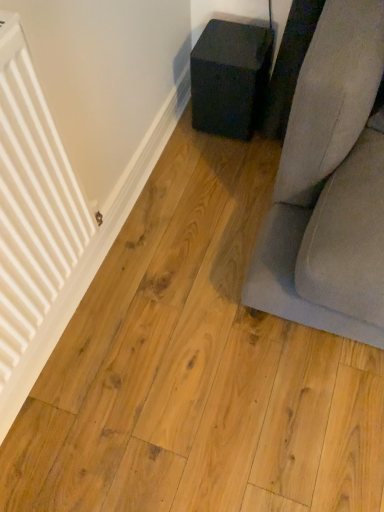
What do you see at coordinates (32, 225) in the screenshot?
I see `white matte radiator at left` at bounding box center [32, 225].

In order to click on white matte radiator at left in this screenshot , I will do `click(32, 225)`.

Measure the distance between matte black cube at center and camera.

The distance of matte black cube at center from camera is 4.59 feet.

This screenshot has height=512, width=384. I want to click on matte black cube at center, so click(230, 77).

What do you see at coordinates (230, 77) in the screenshot? I see `matte black cube at center` at bounding box center [230, 77].

Identify the location of white matte radiator at left. Image resolution: width=384 pixels, height=512 pixels. (32, 225).

Considering the positions of objects matte black cube at center and white matte radiator at left in the image provided, who is more to the left, matte black cube at center or white matte radiator at left?

From the viewer's perspective, white matte radiator at left appears more on the left side.

Which object is further away from the camera, matte black cube at center or white matte radiator at left?

Positioned behind is matte black cube at center.

Is point (211, 32) more distant than point (30, 339)?

Yes, it is.

From the image's perspective, is matte black cube at center above white matte radiator at left?

Yes, from the image's perspective, matte black cube at center is over white matte radiator at left.

Consider the image. From a real-world perspective, which is physically above, matte black cube at center or white matte radiator at left?

white matte radiator at left is physically above.

Between matte black cube at center and white matte radiator at left, which one has smaller width?

With smaller width is white matte radiator at left.

From their relative heights in the image, would you say matte black cube at center is taller or shorter than white matte radiator at left?

In the image, matte black cube at center appears to be shorter than white matte radiator at left.

Based on their sizes in the image, would you say matte black cube at center is bigger or smaller than white matte radiator at left?

Clearly, matte black cube at center is smaller in size than white matte radiator at left.

Is white matte radiator at left surrounded by matte black cube at center?

→ No.

Does matte black cube at center touch white matte radiator at left?

matte black cube at center is not next to white matte radiator at left, and they're not touching.

Is matte black cube at center facing towards white matte radiator at left?

Yes, matte black cube at center is aimed at white matte radiator at left.

How many degrees apart are the facing directions of matte black cube at center and white matte radiator at left?

85.2 degrees separate the facing orientations of matte black cube at center and white matte radiator at left.

Image resolution: width=384 pixels, height=512 pixels. I want to click on furniture below the white matte radiator at left (from a real-world perspective), so click(230, 77).

In the scene shown: Considering the positions of objects white matte radiator at left and matte black cube at center in the image provided, who is more to the left, white matte radiator at left or matte black cube at center?

From the viewer's perspective, white matte radiator at left appears more on the left side.

In the image, is white matte radiator at left positioned in front of or behind matte black cube at center?

Clearly, white matte radiator at left is in front of matte black cube at center.

Is point (28, 176) closer or farther from the camera than point (217, 102)?

Point (28, 176) is positioned closer to the camera compared to point (217, 102).

From the image's perspective, which one is positioned lower, white matte radiator at left or matte black cube at center?

From the image's view, white matte radiator at left is below.

From a real-world perspective, relative to matte black cube at center, is white matte radiator at left vertically above or below?

Clearly, from a real-world perspective, white matte radiator at left is above matte black cube at center.

Can you confirm if white matte radiator at left is wider than matte black cube at center?

No, white matte radiator at left is not wider than matte black cube at center.

Does white matte radiator at left have a greater height compared to matte black cube at center?

Correct, white matte radiator at left is much taller as matte black cube at center.

In the scene shown: Is white matte radiator at left bigger or smaller than matte black cube at center?

Clearly, white matte radiator at left is larger in size than matte black cube at center.

Which is correct: white matte radiator at left is inside matte black cube at center, or outside of it?

white matte radiator at left is not enclosed by matte black cube at center.

Is white matte radiator at left in contact with matte black cube at center?

No, white matte radiator at left is not in contact with matte black cube at center.

Is matte black cube at center at the back of white matte radiator at left?

white matte radiator at left does not have its back to matte black cube at center.

How different are the orientations of white matte radiator at left and matte black cube at center in degrees?

The angular difference between white matte radiator at left and matte black cube at center is 85.2 degrees.

How much distance is there between white matte radiator at left and matte black cube at center?

white matte radiator at left is 32.86 inches from matte black cube at center.

This screenshot has width=384, height=512. Identify the location of furniture below the white matte radiator at left (from a real-world perspective). (230, 77).

Image resolution: width=384 pixels, height=512 pixels. I want to click on furniture above the white matte radiator at left (from the image's perspective), so click(x=230, y=77).

Identify the location of furniture lying on the right of white matte radiator at left. The height and width of the screenshot is (512, 384). (230, 77).